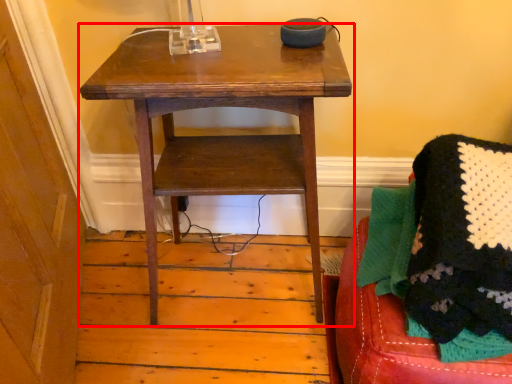
Question: Where is table (annotated by the red box) located in relation to furniture in the image?

Choices:
 (A) right
 (B) left

Answer: (B)